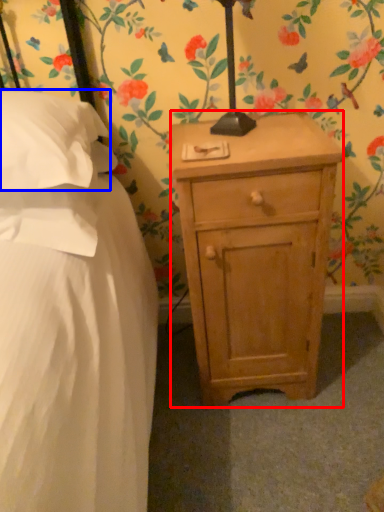
Question: Which object is closer to the camera taking this photo, nightstand (highlighted by a red box) or pillow (highlighted by a blue box)?

Choices:
 (A) nightstand
 (B) pillow

Answer: (B)